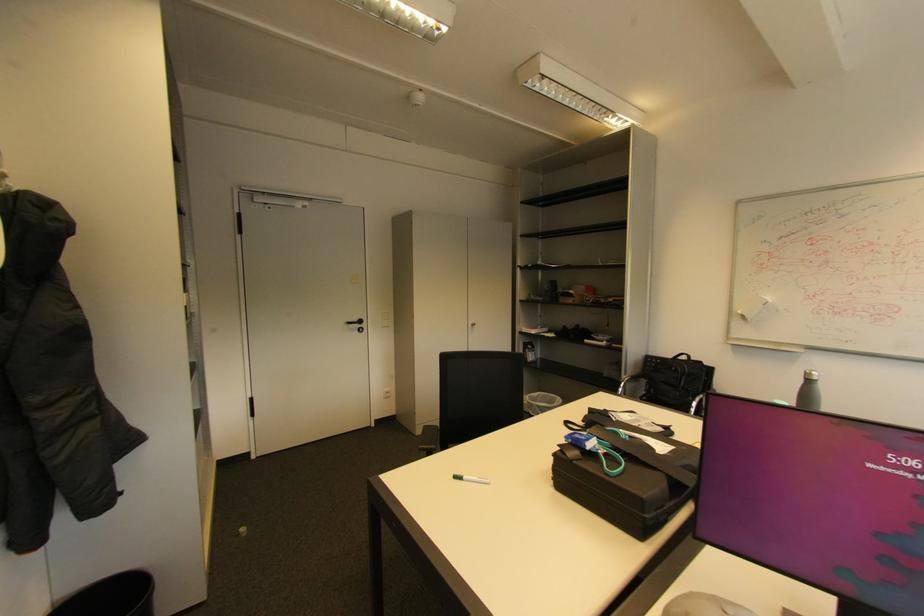
The location [703,605] corresponds to which object?

It corresponds to the white computer mouse in the image.